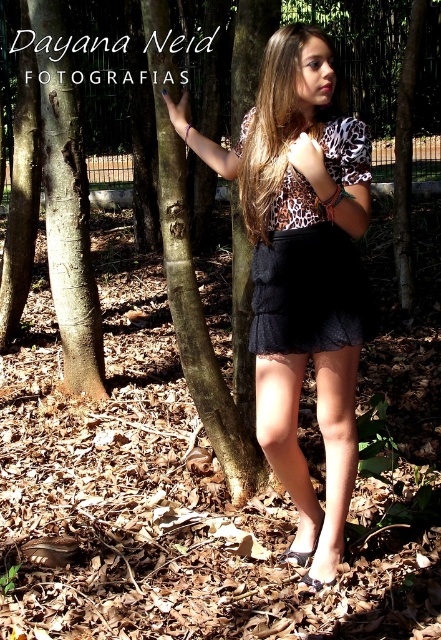
Between brown rough tree trunk at left and black lace skirt at center, which one is positioned higher?

brown rough tree trunk at left is higher up.

Is point (47, 230) closer to viewer compared to point (272, 266)?

No, (47, 230) is further to viewer.

Is point (52, 13) less distant than point (257, 292)?

That is False.

Find the location of a particular element. This screenshot has width=441, height=640. brown rough tree trunk at left is located at coordinates point(67,204).

Is brown rough tree trunk at left thinner than brown silky hair at center?

Yes.

Is point (79, 163) positioned behind point (249, 182)?

Yes, it is.

The width and height of the screenshot is (441, 640). What do you see at coordinates (67, 204) in the screenshot?
I see `brown rough tree trunk at left` at bounding box center [67, 204].

Where is `brown rough tree trunk at left`? brown rough tree trunk at left is located at coordinates coord(67,204).

Is black lace skirt at center to the right of brown silky hair at center from the viewer's perspective?

Indeed, black lace skirt at center is positioned on the right side of brown silky hair at center.

Which is below, black lace skirt at center or brown silky hair at center?

black lace skirt at center is below.

This screenshot has height=640, width=441. I want to click on black lace skirt at center, so click(x=309, y=292).